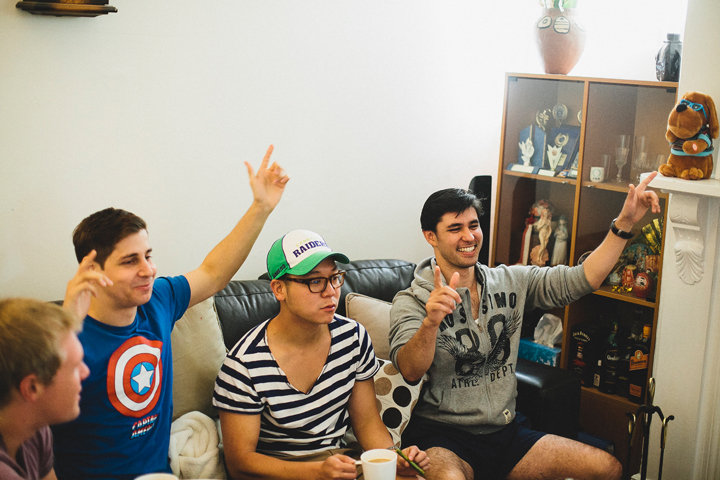
This screenshot has width=720, height=480. Find the location of `fireplace tools`. fireplace tools is located at coordinates (662, 436), (646, 438), (631, 425).